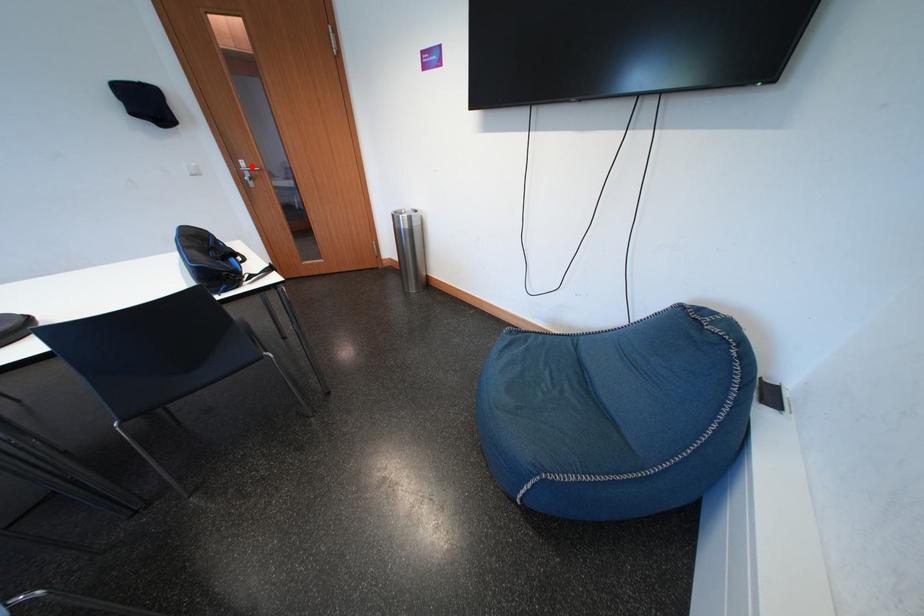
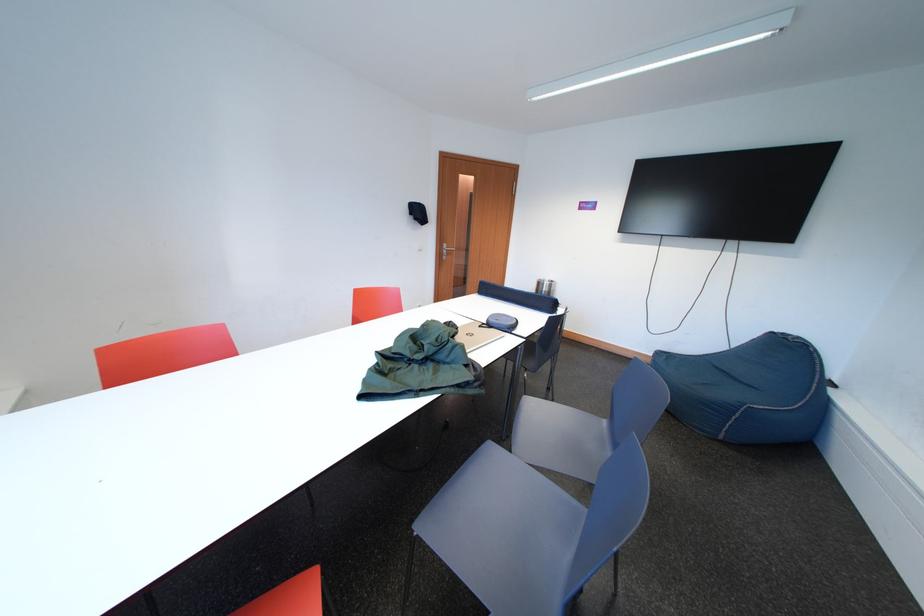
Locate, in the second image, the point that corresponds to the highlighted location in the first image.

(455, 249)